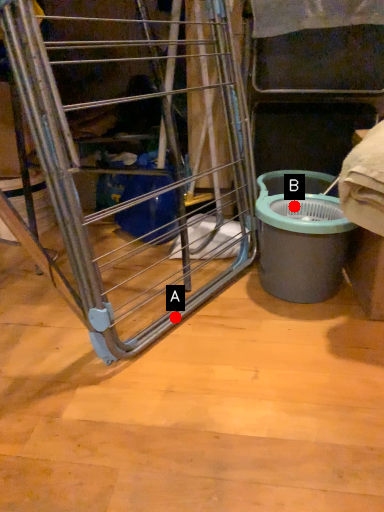
Question: Two points are circled on the image, labeled by A and B beside each circle. Which point appears closest to the camera in this image?

Choices:
 (A) A is closer
 (B) B is closer

Answer: (A)